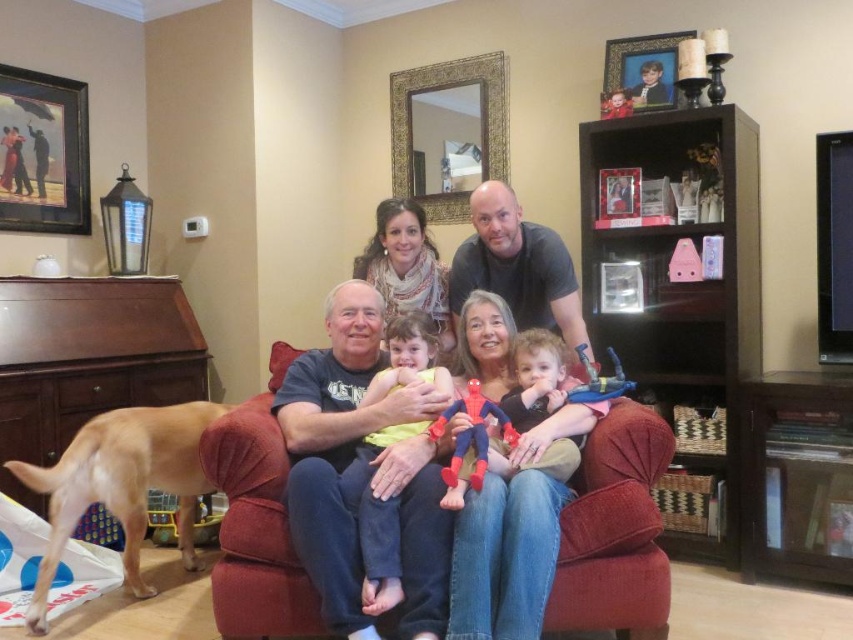
Measure the distance from matte blue jeans at center to golden fur dog at lower left.

matte blue jeans at center is 32.34 inches away from golden fur dog at lower left.

Does matte blue jeans at center have a greater width compared to golden fur dog at lower left?

Indeed, matte blue jeans at center has a greater width compared to golden fur dog at lower left.

Is point (323, 412) in front of point (138, 470)?

Yes, point (323, 412) is in front of point (138, 470).

Where is `matte blue jeans at center`? matte blue jeans at center is located at coordinates (x=335, y=492).

Does matte black picture frame at upper left have a larger size compared to wooden picture frame at upper center?

Yes.

Is point (44, 92) positioned in front of point (618, 54)?

No, it is not.

Identify the location of matte black picture frame at upper left. The height and width of the screenshot is (640, 853). (44, 152).

How far apart are matte blue jeans at center and matte black picture frame at upper left?

The distance of matte blue jeans at center from matte black picture frame at upper left is 2.06 meters.

Who is more distant from viewer, [340,516] or [33,88]?

The point [33,88] is behind.

Between point (413, 449) and point (18, 100), which one is positioned behind?

The point (18, 100) is behind.

Identify the location of matte blue jeans at center. The image size is (853, 640). (335, 492).